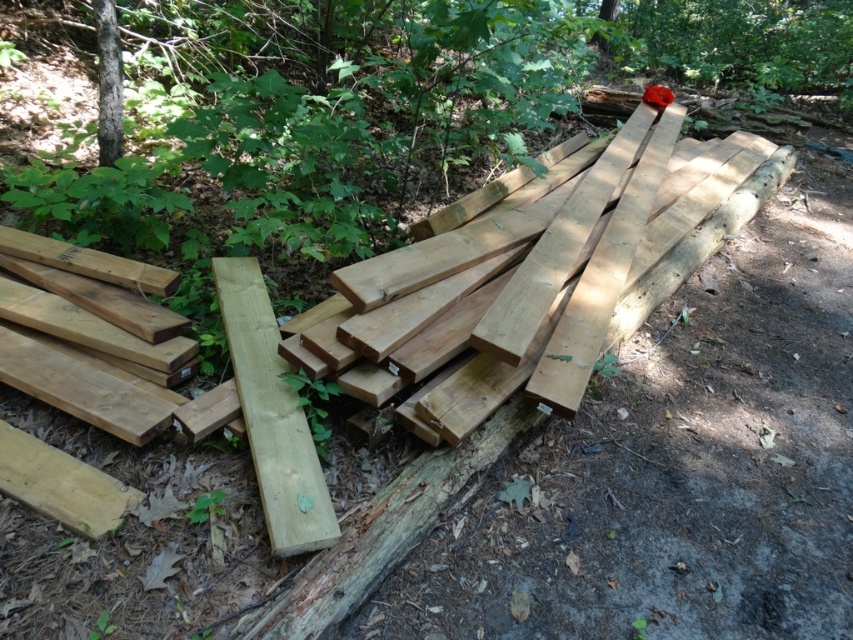
Is natural light wood plank at center wider than smooth brown tree trunk at upper left?

Indeed, natural light wood plank at center has a greater width compared to smooth brown tree trunk at upper left.

Where is `natural light wood plank at center`? The width and height of the screenshot is (853, 640). natural light wood plank at center is located at coordinates (271, 416).